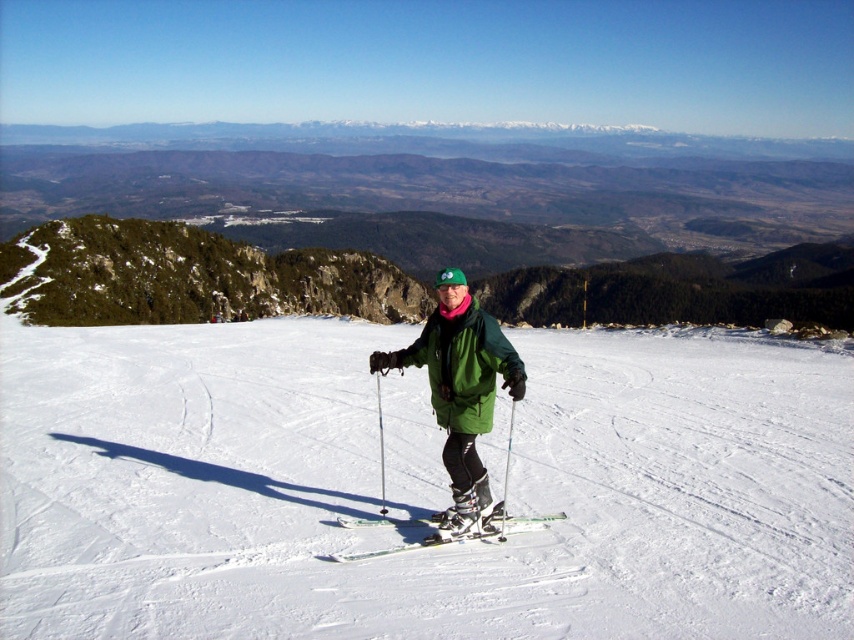
Who is more distant from viewer, [722,468] or [445,417]?

The point [722,468] is more distant.

Does white smooth snow at center appear under green matte jacket at center?

Indeed, white smooth snow at center is positioned under green matte jacket at center.

Is point (563, 400) more distant than point (478, 426)?

Yes, point (563, 400) is behind point (478, 426).

Image resolution: width=854 pixels, height=640 pixels. I want to click on white smooth snow at center, so click(378, 490).

How much distance is there between white smooth snow at center and metallic silver ski pole at center?

A distance of 8.86 meters exists between white smooth snow at center and metallic silver ski pole at center.

Can you confirm if white smooth snow at center is taller than metallic silver ski pole at center?

Correct, white smooth snow at center is much taller as metallic silver ski pole at center.

At what (x,y) coordinates should I click in order to perform the action: click on white smooth snow at center. Please return your answer as a coordinate pair (x, y). This screenshot has height=640, width=854. Looking at the image, I should click on (378, 490).

Measure the distance between green matte skis at center and metallic silver ski pole at center.

green matte skis at center and metallic silver ski pole at center are 11.69 feet apart from each other.

Is point (513, 528) positioned before point (375, 381)?

Yes.

Find the location of a particular element. This screenshot has width=854, height=640. green matte skis at center is located at coordinates (449, 536).